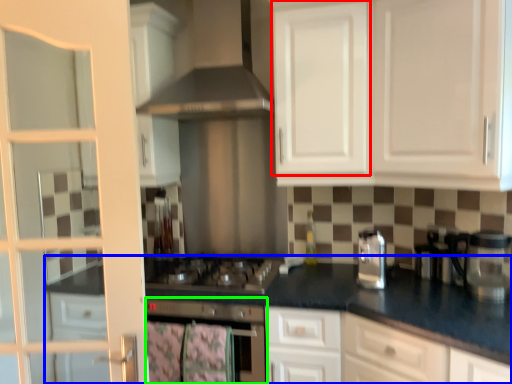
Question: Considering the real-world distances, which object is farthest from cabinetry (highlighted by a red box)? countertop (highlighted by a blue box) or home appliance (highlighted by a green box)?

Choices:
 (A) countertop
 (B) home appliance

Answer: (B)